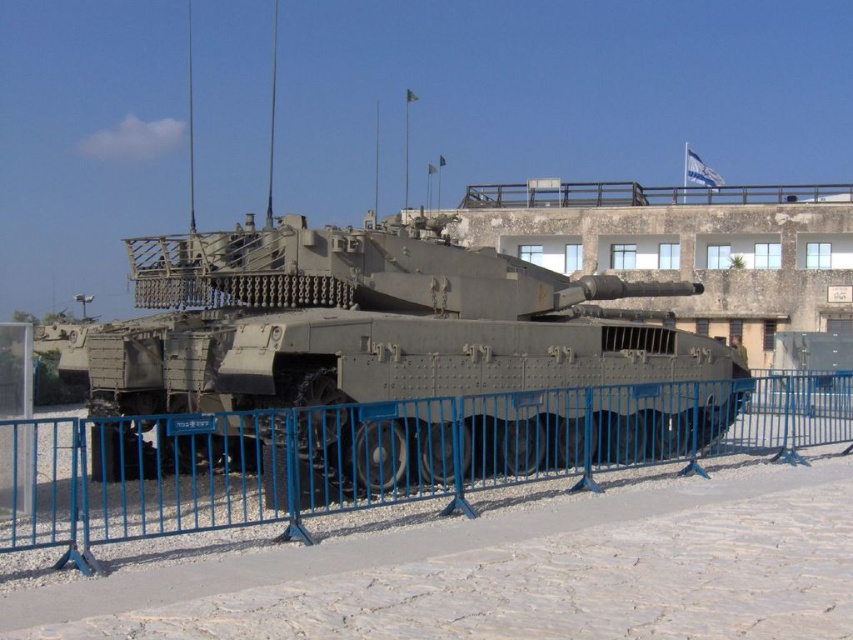
Question: Does camouflage paint tank at center have a lesser width compared to blue metal fence at lower center?

Choices:
 (A) no
 (B) yes

Answer: (A)

Question: Which object is closer to the camera taking this photo?

Choices:
 (A) blue metal fence at lower center
 (B) camouflage paint tank at center

Answer: (A)

Question: Can you confirm if camouflage paint tank at center is positioned to the left of blue metal fence at lower center?

Choices:
 (A) no
 (B) yes

Answer: (B)

Question: In this image, where is camouflage paint tank at center located relative to blue metal fence at lower center?

Choices:
 (A) below
 (B) above

Answer: (B)

Question: Among these points, which one is nearest to the camera?

Choices:
 (A) (657, 365)
 (B) (701, 467)

Answer: (B)